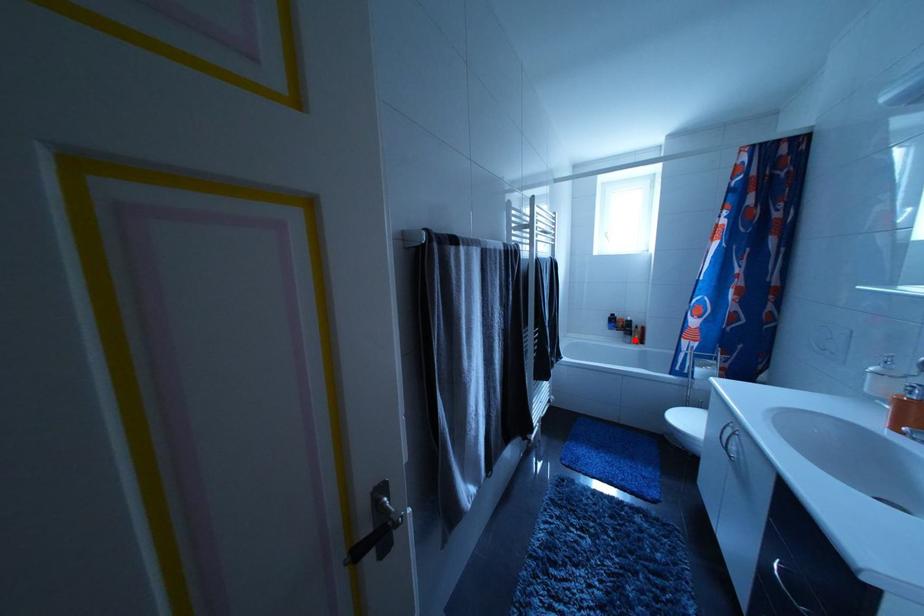
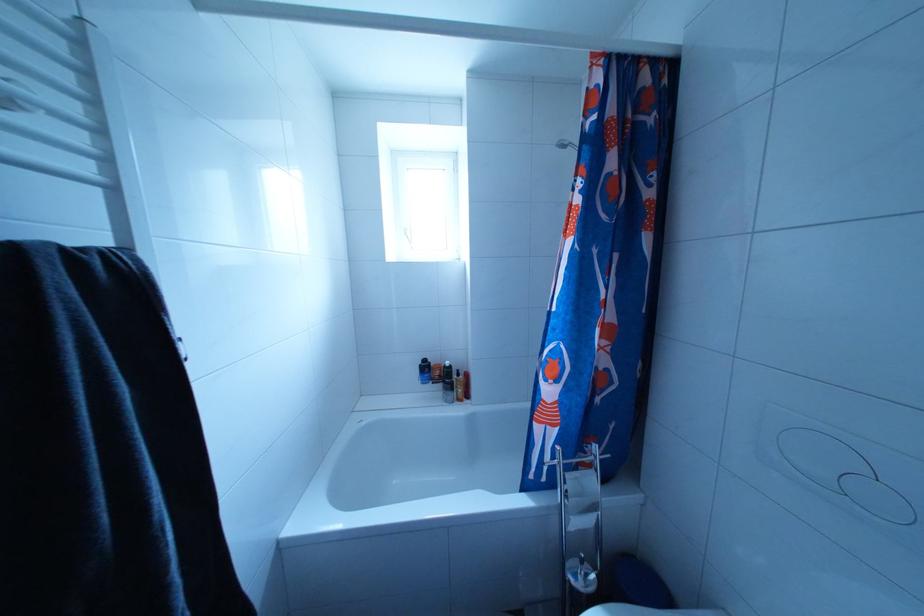
Question: A red point is marked in image1. In image2, is the corresponding 3D point closer to the camera or farther? Reply with the corresponding letter.

Choices:
 (A) The corresponding 3D point is closer.
 (B) The corresponding 3D point is farther.

Answer: (B)